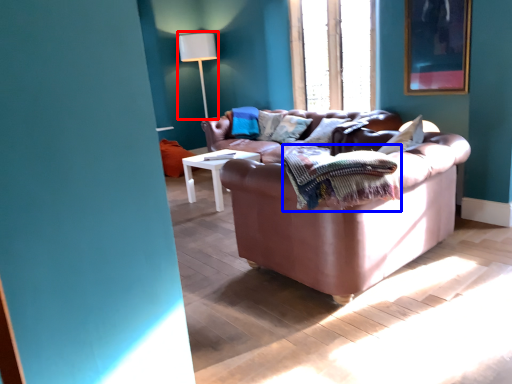
Question: Which object appears closest to the camera in this image, table lamp (highlighted by a red box) or blanket (highlighted by a blue box)?

Choices:
 (A) table lamp
 (B) blanket

Answer: (B)